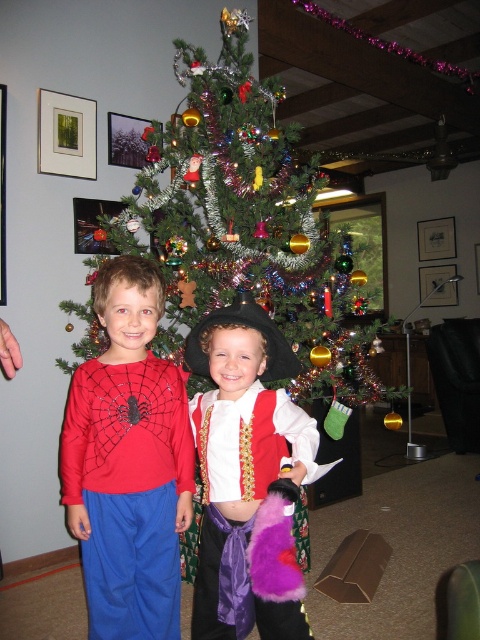
You are standing in the living room and want to place a gift under the Christmas tree. The gift needs to be placed at the point closer to the wall where the tree is located. Which point should you choose between point [80,220] and point [434,236]?

Point [80,220] is in front of point [434,236], so the point closer to the wall where the tree is located is point [434,236].